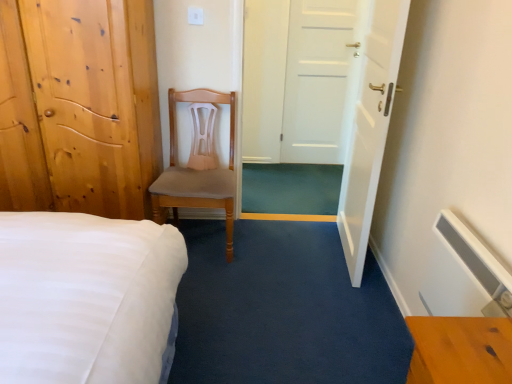
Where is `vacant region under white glossy door at center, the 3th door viewed from the left (from a real-world perspective)`? The width and height of the screenshot is (512, 384). vacant region under white glossy door at center, the 3th door viewed from the left (from a real-world perspective) is located at coordinates (334, 236).